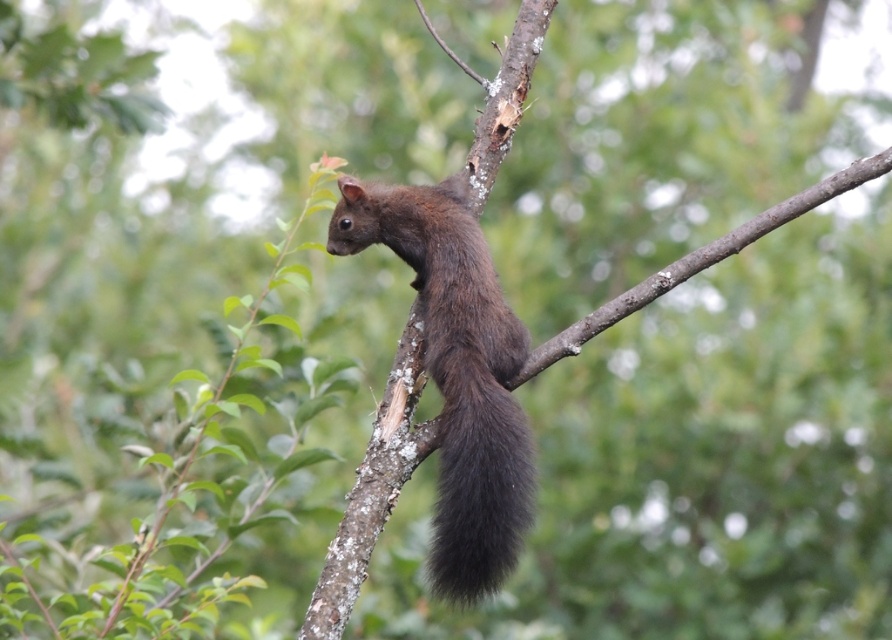
Which is in front, point (525, 516) or point (465, 518)?

Positioned in front is point (525, 516).

Is shiny brown squirrel at center bigger than black fuzzy tail at center?

Yes.

Does point (491, 492) come in front of point (455, 348)?

That is True.

In order to click on shiny brown squirrel at center in this screenshot , I will do `click(456, 372)`.